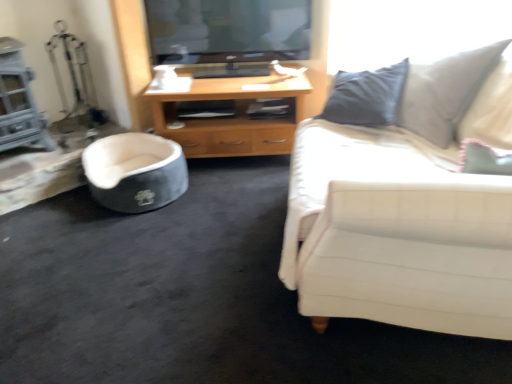
Question: Is the depth of white fabric couch at right greater than that of wooden cabinet at center?

Choices:
 (A) no
 (B) yes

Answer: (A)

Question: Does white fabric couch at right have a lesser width compared to wooden cabinet at center?

Choices:
 (A) yes
 (B) no

Answer: (B)

Question: Is white fabric couch at right outside of wooden cabinet at center?

Choices:
 (A) no
 (B) yes

Answer: (B)

Question: From the image's perspective, is white fabric couch at right located above wooden cabinet at center?

Choices:
 (A) yes
 (B) no

Answer: (B)

Question: Can you confirm if white fabric couch at right is wider than wooden cabinet at center?

Choices:
 (A) no
 (B) yes

Answer: (B)

Question: Visually, is white fabric couch at right positioned to the left or to the right of wooden cabinet at center?

Choices:
 (A) left
 (B) right

Answer: (B)

Question: In the image, is white fabric couch at right positioned in front of or behind wooden cabinet at center?

Choices:
 (A) front
 (B) behind

Answer: (A)

Question: Do you think white fabric couch at right is within wooden cabinet at center, or outside of it?

Choices:
 (A) outside
 (B) inside

Answer: (A)

Question: Looking at the image, does white fabric couch at right seem bigger or smaller compared to wooden cabinet at center?

Choices:
 (A) big
 (B) small

Answer: (A)

Question: Considering the positions of soft gray fabric pet bed at lower left and wooden cabinet at center in the image, is soft gray fabric pet bed at lower left taller or shorter than wooden cabinet at center?

Choices:
 (A) tall
 (B) short

Answer: (B)

Question: Is point (146, 167) positioned closer to the camera than point (286, 84)?

Choices:
 (A) closer
 (B) farther

Answer: (A)

Question: Is soft gray fabric pet bed at lower left wider or thinner than wooden cabinet at center?

Choices:
 (A) thin
 (B) wide

Answer: (A)

Question: Is soft gray fabric pet bed at lower left in front of or behind wooden cabinet at center in the image?

Choices:
 (A) behind
 (B) front

Answer: (B)

Question: Based on their sizes in the image, would you say soft gray fabric pet bed at lower left is bigger or smaller than white fabric couch at right?

Choices:
 (A) big
 (B) small

Answer: (B)

Question: Is soft gray fabric pet bed at lower left inside the boundaries of white fabric couch at right, or outside?

Choices:
 (A) inside
 (B) outside

Answer: (B)